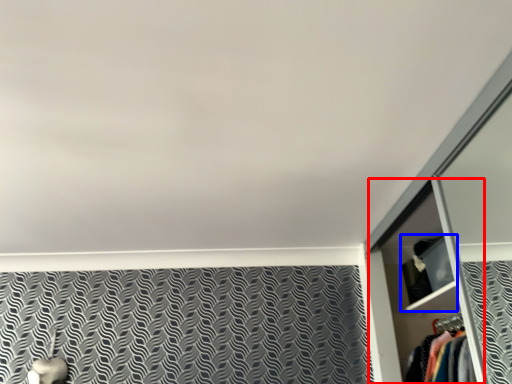
Question: Which point is further to the camera, dresser (highlighted by a red box) or cabinet (highlighted by a blue box)?

Choices:
 (A) dresser
 (B) cabinet

Answer: (B)